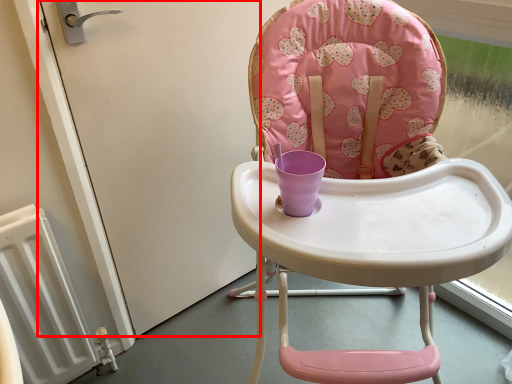
Question: In this image, where is screen door (annotated by the red box) located relative to chair?

Choices:
 (A) right
 (B) left

Answer: (B)